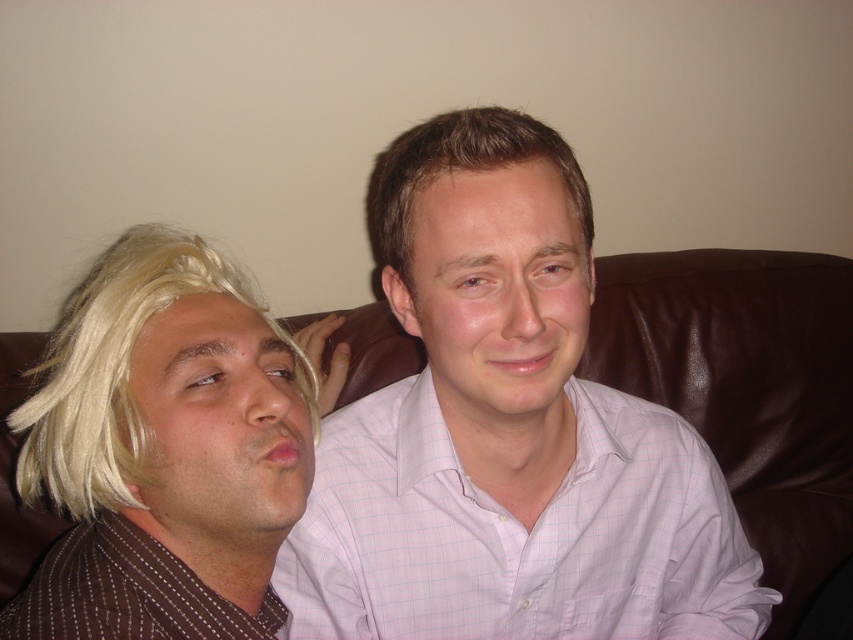
Who is taller, brown leather couch at center or blonde synthetic wig at left?

brown leather couch at center is taller.

Does brown leather couch at center appear on the left side of blonde synthetic wig at left?

In fact, brown leather couch at center is to the right of blonde synthetic wig at left.

What do you see at coordinates (747, 388) in the screenshot? The width and height of the screenshot is (853, 640). I see `brown leather couch at center` at bounding box center [747, 388].

Identify the location of brown leather couch at center. This screenshot has width=853, height=640. (747, 388).

How far apart are pink checkered shirt at center and brown leather couch at center?

A distance of 23.52 inches exists between pink checkered shirt at center and brown leather couch at center.

Is point (492, 628) positioned after point (817, 452)?

No, (492, 628) is in front of (817, 452).

Between point (561, 538) and point (653, 397), which one is positioned in front?

Positioned in front is point (561, 538).

The height and width of the screenshot is (640, 853). Identify the location of pink checkered shirt at center. (517, 532).

Can you confirm if pink checkered shirt at center is bigger than brown smooth hair at center?

Indeed, pink checkered shirt at center has a larger size compared to brown smooth hair at center.

Is point (479, 554) in front of point (508, 115)?

No.

Locate an element on the screen. Image resolution: width=853 pixels, height=640 pixels. pink checkered shirt at center is located at coordinates (517, 532).